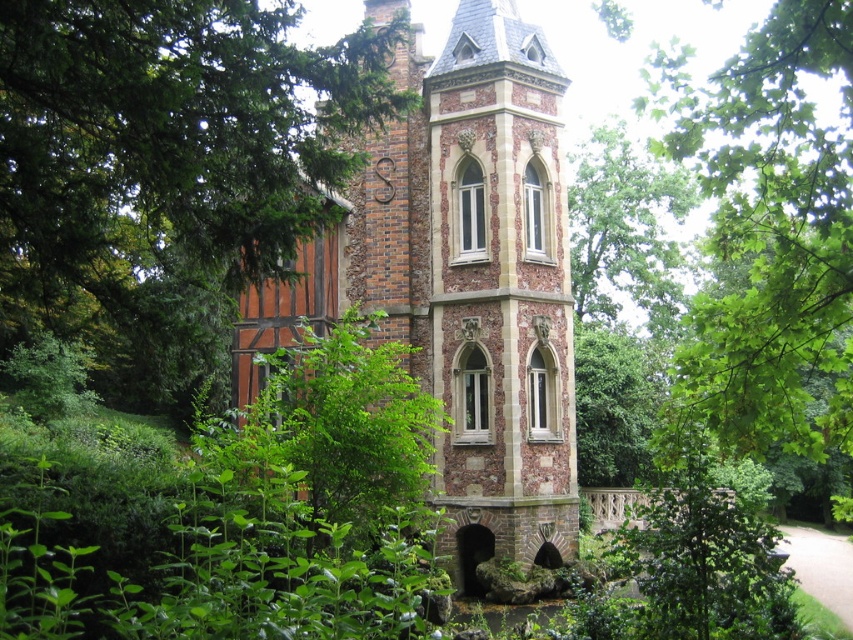
You are an architect examining the building from a specific viewpoint. You notice two points marked on the building structure. The first point is at coordinates point (479, 33) and the second is at point (722, 442). Which of these two points is closer to your current viewpoint?

Point (479, 33) is closer to your viewpoint because it is further to the viewer than point (722, 442).

You are an architect analyzing the layout of this historic building. Based on the image, can you determine which object is positioned higher in the scene between the brick tower at center and the green leafy tree at upper center?

The green leafy tree at upper center is positioned higher in the scene than the brick tower at center.

You are an architect analyzing the building and its surroundings. Based on the scene, which object is taller between the brick tower at center and the green leafy tree at upper center?

The green leafy tree at upper center is taller than the brick tower at center.